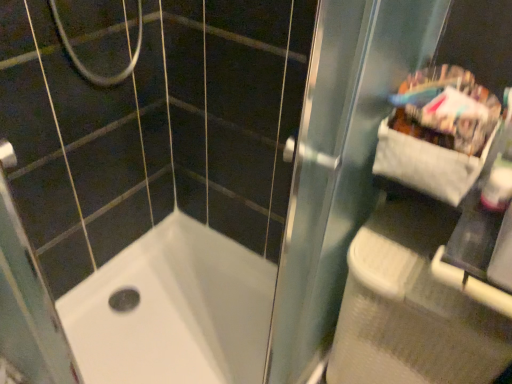
Where is `white glossy bathtub at center`? Image resolution: width=512 pixels, height=384 pixels. white glossy bathtub at center is located at coordinates (173, 310).

Describe the element at coordinates (173, 310) in the screenshot. The image size is (512, 384). I see `white glossy bathtub at center` at that location.

Identify the location of white glossy bathtub at center. (173, 310).